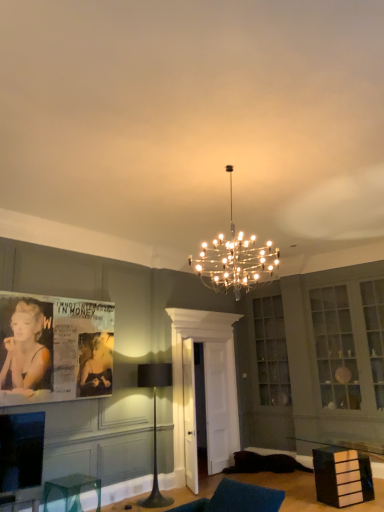
Question: In terms of size, does clear glass cube at lower left, which appears as the second furniture when viewed from the right, appear bigger or smaller than clear glass chandelier at center, acting as the 1th lamp starting from the front?

Choices:
 (A) big
 (B) small

Answer: (B)

Question: From their relative heights in the image, would you say clear glass cube at lower left, the 1th furniture positioned from the left, is taller or shorter than clear glass chandelier at center, the second lamp viewed from the left?

Choices:
 (A) short
 (B) tall

Answer: (A)

Question: Estimate the real-world distances between objects in this image. Which object is closer to the black glossy drawer at lower right, acting as the 2th furniture starting from the left?

Choices:
 (A) clear glass door at center
 (B) clear glass cube at lower left, the 1th furniture positioned from the left
 (C) clear glass chandelier at center, positioned as the 2th lamp in back-to-front order
 (D) black matte floor lamp at center, which is the 1th lamp from left to right
 (E) matte paper poster at left

Answer: (A)

Question: Which is nearer to the black glossy drawer at lower right, acting as the 2th furniture starting from the left?

Choices:
 (A) black matte floor lamp at center, arranged as the 2th lamp when viewed from the top
 (B) matte paper poster at left
 (C) clear glass chandelier at center, which is the 1th lamp in top-to-bottom order
 (D) clear glass door at center
 (E) clear glass cube at lower left, which appears as the second furniture when viewed from the right

Answer: (D)